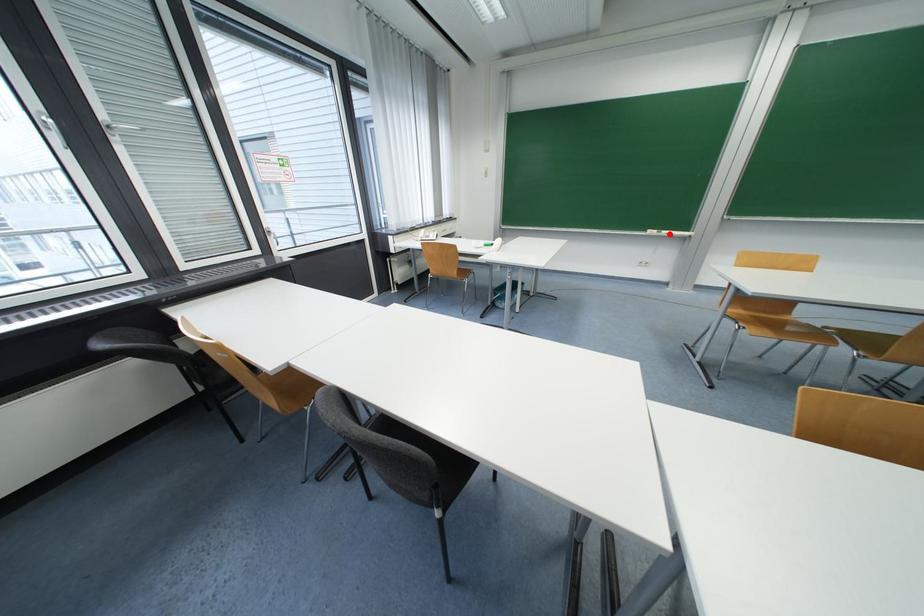
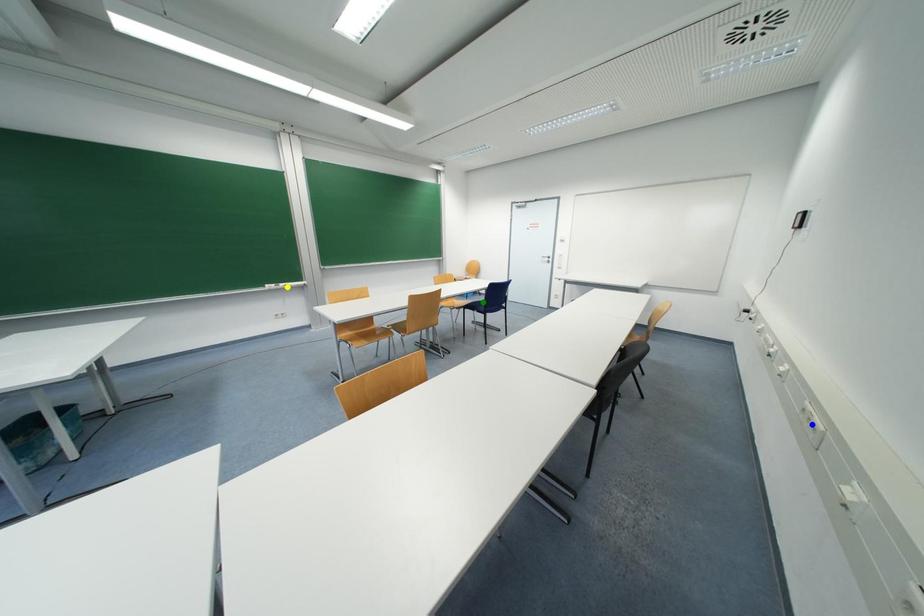
Question: I am providing you with two images of the same scene from different viewpoints. A red point is marked on the first image. You are given multiple points on the second image. Which point in image 2 is actually the same real-world point as the red point in image 1?

Choices:
 (A) green point
 (B) blue point
 (C) yellow point

Answer: (C)